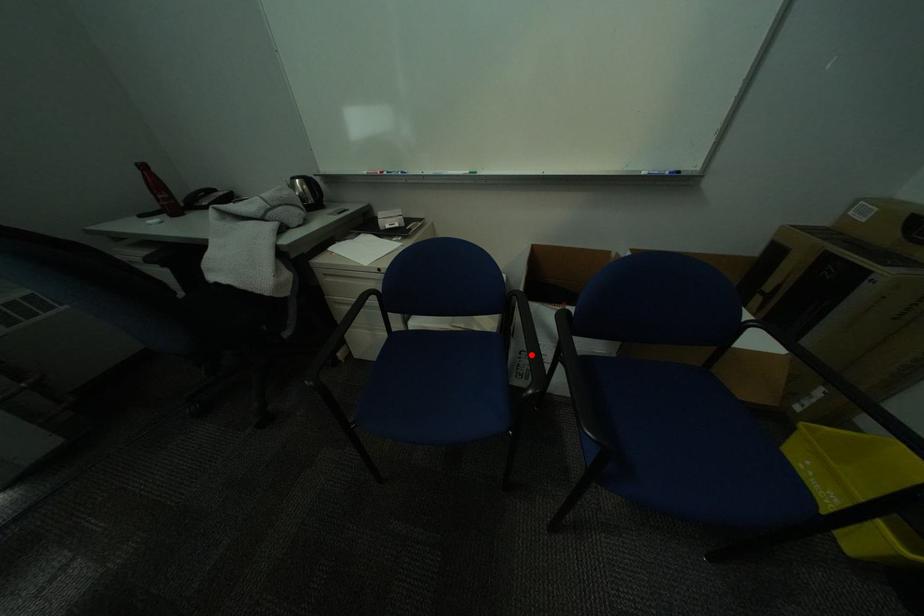
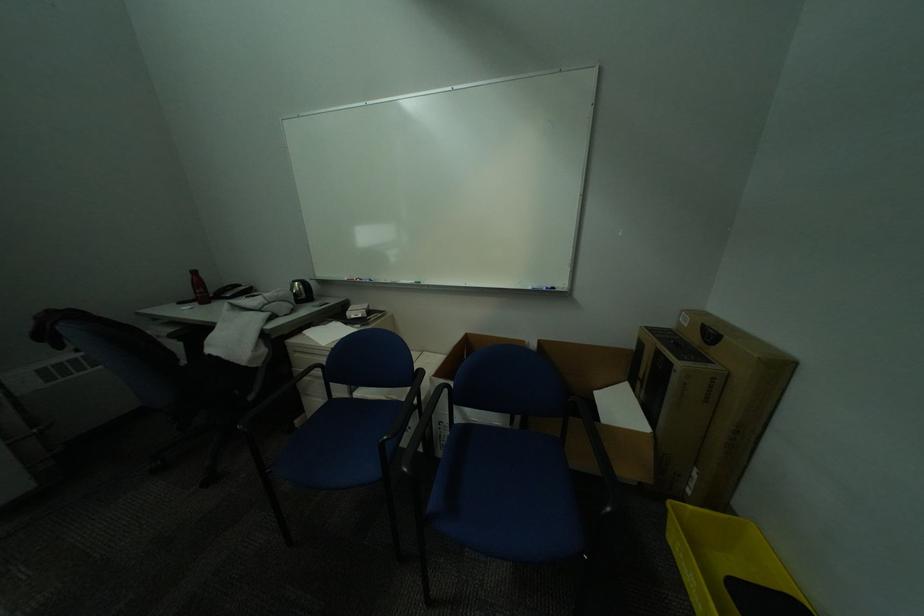
The point at the highlighted location is marked in the first image. Where is the corresponding point in the second image?

(451, 426)